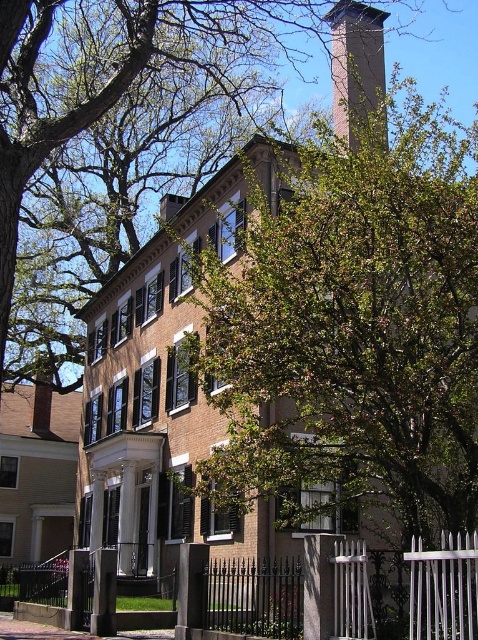
Can you confirm if green leafy tree at center is thinner than green leafy tree at upper center?

Yes, green leafy tree at center is thinner than green leafy tree at upper center.

Between point (391, 244) and point (32, 24), which one is positioned in front?

Point (391, 244) is in front.

I want to click on green leafy tree at center, so click(x=350, y=316).

Looking at this image, between black wrought iron fence at lower left and smooth brick chimney at upper center, which one is positioned lower?

Positioned lower is black wrought iron fence at lower left.

Which is in front, point (314, 598) or point (354, 22)?

Point (314, 598) is in front.

The image size is (478, 640). What are the coordinates of `black wrought iron fence at lower left` in the screenshot? It's located at (x=283, y=595).

The width and height of the screenshot is (478, 640). In order to click on black wrought iron fence at lower left in this screenshot , I will do `click(283, 595)`.

Is the position of green leafy tree at center less distant than that of black wrought iron fence at lower left?

No, it is not.

Is green leafy tree at center to the right of black wrought iron fence at lower left from the viewer's perspective?

Yes, green leafy tree at center is to the right of black wrought iron fence at lower left.

Which is behind, point (402, 452) or point (402, 563)?

The point (402, 563) is more distant.

Where is `green leafy tree at center`? This screenshot has height=640, width=478. green leafy tree at center is located at coordinates (350, 316).